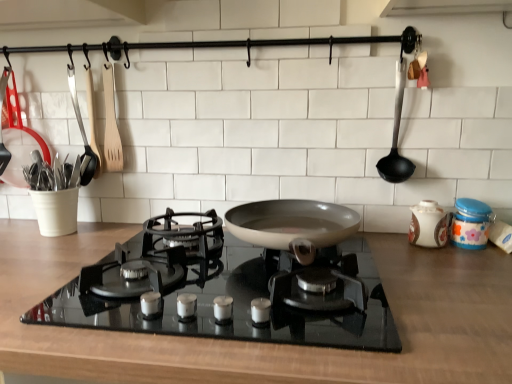
Question: Considering the positions of black plastic ladle at right and white plastic utensil holder at left, the 1th kitchen appliance from the left, in the image, is black plastic ladle at right wider or thinner than white plastic utensil holder at left, the 1th kitchen appliance from the left,?

Choices:
 (A) thin
 (B) wide

Answer: (A)

Question: From the image's perspective, is black plastic ladle at right above or below white plastic utensil holder at left, the 1th kitchen appliance from the left?

Choices:
 (A) below
 (B) above

Answer: (A)

Question: Which object is the farthest from the wooden spatula at upper left, the third kitchen appliance when ordered from left to right?

Choices:
 (A) white plastic utensil holder at left, the 1th kitchen appliance from the left
 (B) porcelain jar at right, which is counted as the 2th kitchen appliance, starting from the right
 (C) black glass gas stove at center
 (D) black plastic ladle at right
 (E) wooden spatula at left, which ranks as the 4th kitchen appliance in right-to-left order

Answer: (B)

Question: Based on their relative distances, which object is farther from the white plastic utensil holder at left, the 1th kitchen appliance from the left?

Choices:
 (A) wooden spatula at upper left, the third kitchen appliance when ordered from left to right
 (B) porcelain jar at right, which is counted as the 2th kitchen appliance, starting from the right
 (C) black glass gas stove at center
 (D) wooden spatula at left, which appears as the 2th kitchen appliance when viewed from the left
 (E) blue glossy jar at right, marked as the 1th kitchen appliance in a right-to-left arrangement

Answer: (E)